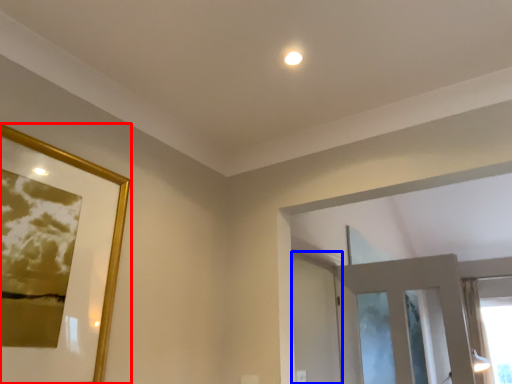
Question: Which point is further to the camera, picture frame (highlighted by a red box) or screen door (highlighted by a blue box)?

Choices:
 (A) picture frame
 (B) screen door

Answer: (B)